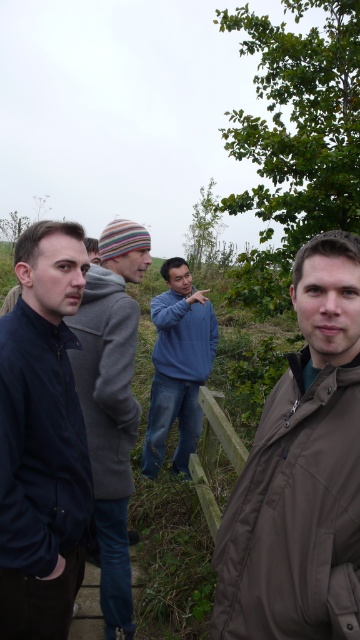
Question: Is matte black jacket at left to the right of blue fleece jacket at center from the viewer's perspective?

Choices:
 (A) no
 (B) yes

Answer: (A)

Question: Considering the real-world distances, which object is closest to the matte black jacket at left?

Choices:
 (A) blue cotton sweater at center
 (B) green wooden fence at center
 (C) blue fleece jacket at center
 (D) gray woolen jacket at left

Answer: (D)

Question: Is blue cotton sweater at center bigger than blue fleece jacket at center?

Choices:
 (A) yes
 (B) no

Answer: (A)

Question: In this image, where is brown matte jacket at lower right located relative to blue fleece jacket at center?

Choices:
 (A) below
 (B) above

Answer: (A)

Question: Which point is closer to the camera taking this photo?

Choices:
 (A) (223, 573)
 (B) (196, 364)

Answer: (A)

Question: Which object appears farthest from the camera in this image?

Choices:
 (A) brown matte jacket at lower right
 (B) matte black jacket at left
 (C) blue cotton sweater at center
 (D) gray woolen jacket at left

Answer: (C)